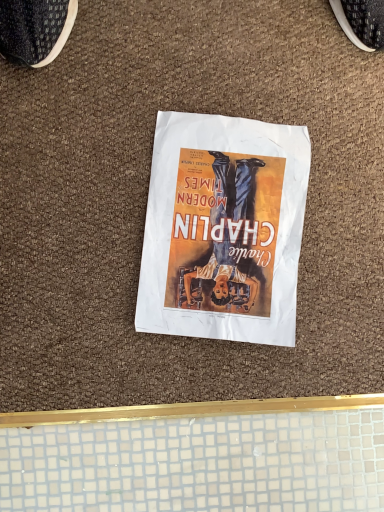
This screenshot has width=384, height=512. What do you see at coordinates (223, 229) in the screenshot?
I see `matte paper poster at center` at bounding box center [223, 229].

What are the coordinates of `matte paper poster at center` in the screenshot? It's located at (223, 229).

The height and width of the screenshot is (512, 384). Identify the location of matte paper poster at center. (223, 229).